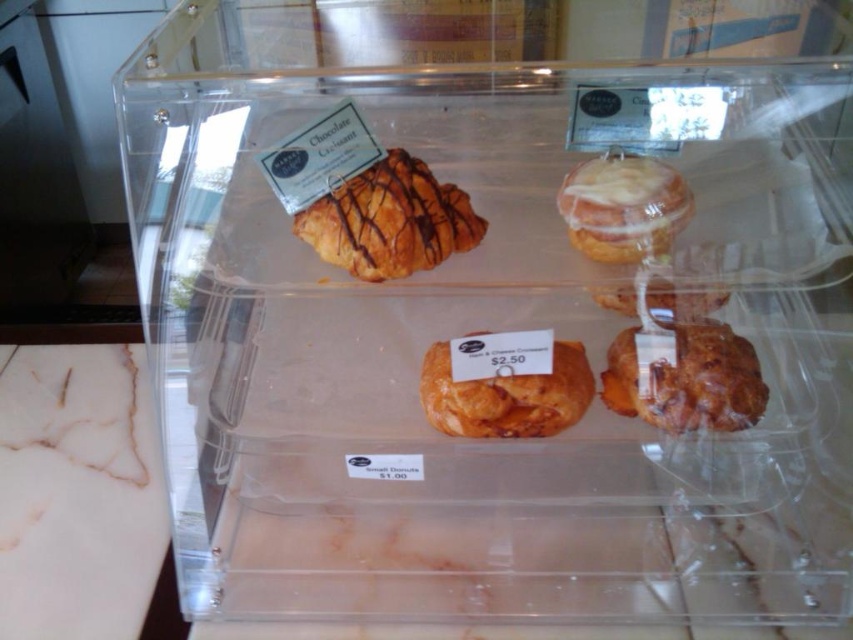
Is point (427, 211) positioned behind point (509, 371)?

Yes, point (427, 211) is behind point (509, 371).

Is golden flaky croissant at upper left below golden flaky croissant at center?

No, golden flaky croissant at upper left is not below golden flaky croissant at center.

Locate an element on the screen. The width and height of the screenshot is (853, 640). golden flaky croissant at upper left is located at coordinates (390, 220).

The width and height of the screenshot is (853, 640). I want to click on golden flaky croissant at upper left, so click(x=390, y=220).

Is point (418, 184) positioned behind point (602, 400)?

No.

Identify the location of golden flaky croissant at upper left. This screenshot has height=640, width=853. (390, 220).

This screenshot has height=640, width=853. What are the coordinates of `golden flaky croissant at center` in the screenshot? It's located at (506, 396).

Does point (494, 372) lie in front of point (627, 243)?

No, (494, 372) is behind (627, 243).

Locate an element on the screen. The image size is (853, 640). golden flaky croissant at center is located at coordinates (506, 396).